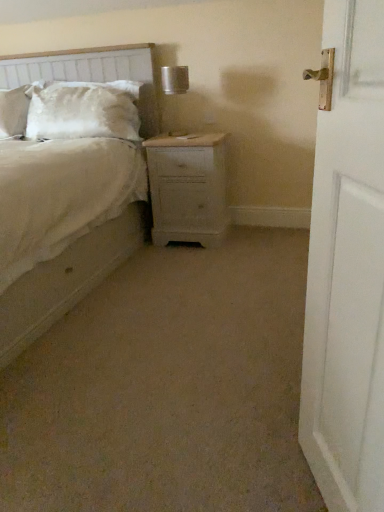
Question: Looking at the image, does textured fabric headboard at upper left seem bigger or smaller compared to beige fabric bed at center?

Choices:
 (A) small
 (B) big

Answer: (A)

Question: Considering the positions of point pyautogui.click(x=51, y=71) and point pyautogui.click(x=49, y=66), is point pyautogui.click(x=51, y=71) closer or farther from the camera than point pyautogui.click(x=49, y=66)?

Choices:
 (A) closer
 (B) farther

Answer: (A)

Question: Considering the real-world distances, which object is closest to the satin white pillow at upper left?

Choices:
 (A) textured fabric headboard at upper left
 (B) white wooden door at right
 (C) beige fabric bed at center
 (D) metallic silver table lamp at upper center
 (E) light wood nightstand at center

Answer: (A)

Question: Which is nearer to the textured fabric headboard at upper left?

Choices:
 (A) beige fabric bed at center
 (B) white wooden door at right
 (C) satin white pillow at upper left
 (D) light wood nightstand at center
 (E) metallic silver table lamp at upper center

Answer: (C)